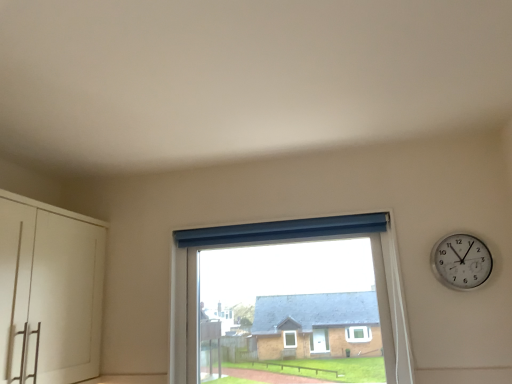
Question: Does silver metallic wall clock at upper right have a greater height compared to white matte cabinet at left?

Choices:
 (A) yes
 (B) no

Answer: (B)

Question: Does silver metallic wall clock at upper right appear on the left side of white matte cabinet at left?

Choices:
 (A) yes
 (B) no

Answer: (B)

Question: Is white matte cabinet at left located within silver metallic wall clock at upper right?

Choices:
 (A) no
 (B) yes

Answer: (A)

Question: Is silver metallic wall clock at upper right beside white matte cabinet at left?

Choices:
 (A) yes
 (B) no

Answer: (B)

Question: Is silver metallic wall clock at upper right positioned with its back to white matte cabinet at left?

Choices:
 (A) no
 (B) yes

Answer: (A)

Question: Is point (31, 261) positioned closer to the camera than point (394, 261)?

Choices:
 (A) closer
 (B) farther

Answer: (A)

Question: Considering the positions of white matte cabinet at left and transparent glass window at center in the image, is white matte cabinet at left taller or shorter than transparent glass window at center?

Choices:
 (A) short
 (B) tall

Answer: (B)

Question: Based on their sizes in the image, would you say white matte cabinet at left is bigger or smaller than transparent glass window at center?

Choices:
 (A) big
 (B) small

Answer: (A)

Question: Is white matte cabinet at left in front of or behind transparent glass window at center in the image?

Choices:
 (A) front
 (B) behind

Answer: (A)

Question: Is point (258, 236) closer or farther from the camera than point (68, 271)?

Choices:
 (A) farther
 (B) closer

Answer: (A)

Question: In the image, is transparent glass window at center on the left side or the right side of white matte cabinet at left?

Choices:
 (A) right
 (B) left

Answer: (A)

Question: Is transparent glass window at center taller or shorter than white matte cabinet at left?

Choices:
 (A) tall
 (B) short

Answer: (B)

Question: Looking at the image, does transparent glass window at center seem bigger or smaller compared to white matte cabinet at left?

Choices:
 (A) big
 (B) small

Answer: (B)

Question: Is silver metallic wall clock at upper right inside or outside of transparent glass window at center?

Choices:
 (A) outside
 (B) inside

Answer: (A)

Question: Does point (470, 273) appear closer or farther from the camera than point (377, 284)?

Choices:
 (A) farther
 (B) closer

Answer: (B)